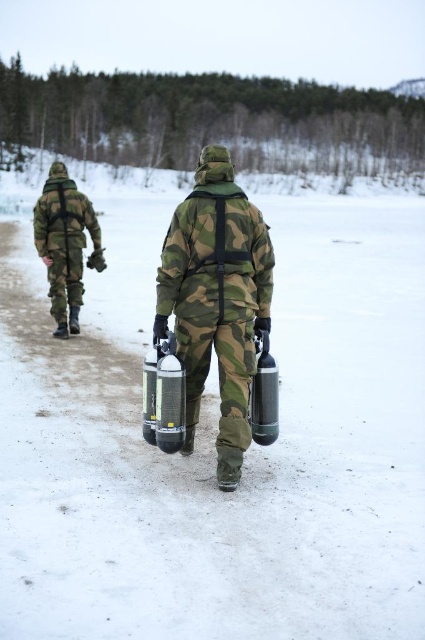
Does camo fabric uniform at center have a larger size compared to metallic silver cylinder at center?

Correct, camo fabric uniform at center is larger in size than metallic silver cylinder at center.

Between camo fabric uniform at center and metallic silver cylinder at center, which one is positioned higher?

Positioned higher is camo fabric uniform at center.

Where is `camo fabric uniform at center`? camo fabric uniform at center is located at coordinates (217, 300).

This screenshot has height=640, width=425. Identify the location of camo fabric uniform at center. (217, 300).

Looking at this image, is camo fabric uniform at center below metallic silver extinguisher at center?

Incorrect, camo fabric uniform at center is not positioned below metallic silver extinguisher at center.

Does camo fabric uniform at center have a lesser height compared to metallic silver extinguisher at center?

No.

Between point (258, 278) and point (156, 435), which one is positioned in front?

Point (156, 435) is more forward.

In order to click on camo fabric uniform at center in this screenshot , I will do `click(217, 300)`.

Between camouflage fabric uniform at left and metallic silver extinguisher at center, which one appears on the right side from the viewer's perspective?

metallic silver extinguisher at center is more to the right.

Between camouflage fabric uniform at left and metallic silver extinguisher at center, which one has less height?

Standing shorter between the two is metallic silver extinguisher at center.

This screenshot has height=640, width=425. In order to click on camouflage fabric uniform at left in this screenshot , I will do `click(65, 244)`.

You are a GUI agent. You are given a task and a screenshot of the screen. Output one action in this format:
    pyautogui.click(x=<x>, y=<y>)
    Task: Click on the camouflage fabric uniform at left
    This screenshot has width=425, height=640.
    Given the screenshot: What is the action you would take?
    pyautogui.click(x=65, y=244)